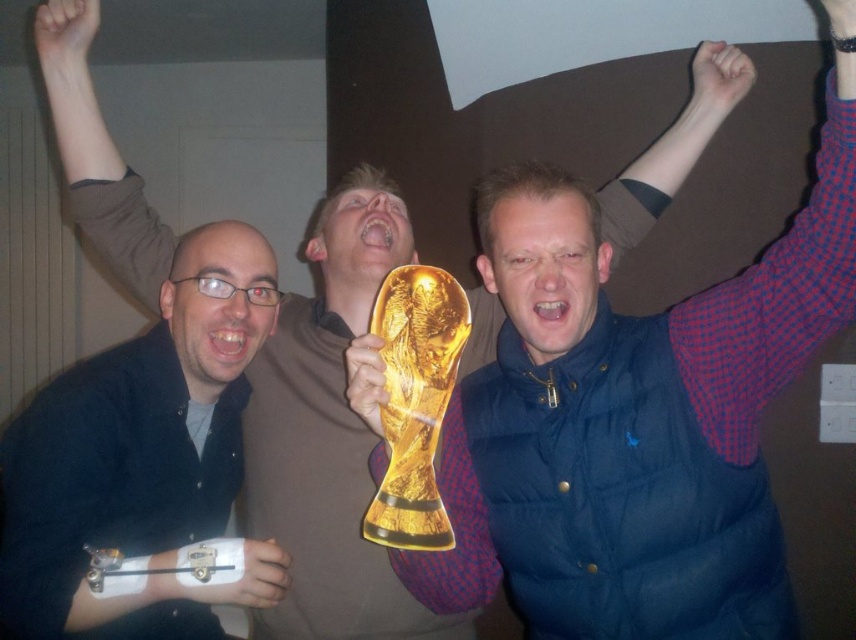
Question: Is blue puffer vest at center to the right of matte black shirt at left from the viewer's perspective?

Choices:
 (A) no
 (B) yes

Answer: (B)

Question: Can you confirm if blue puffer vest at center is wider than matte black shirt at left?

Choices:
 (A) no
 (B) yes

Answer: (B)

Question: Can you confirm if blue puffer vest at center is positioned below matte black shirt at left?

Choices:
 (A) yes
 (B) no

Answer: (B)